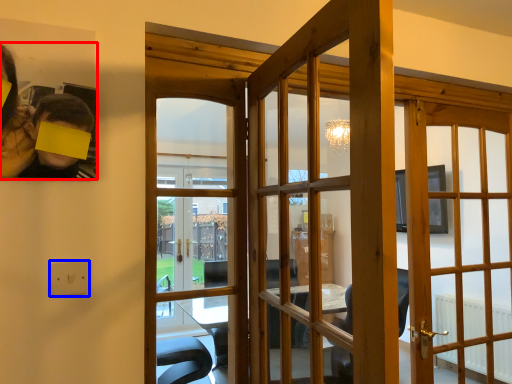
Question: Which of the following is the farthest to the observer, houseplant (highlighted by a red box) or electric outlet (highlighted by a blue box)?

Choices:
 (A) houseplant
 (B) electric outlet

Answer: (B)